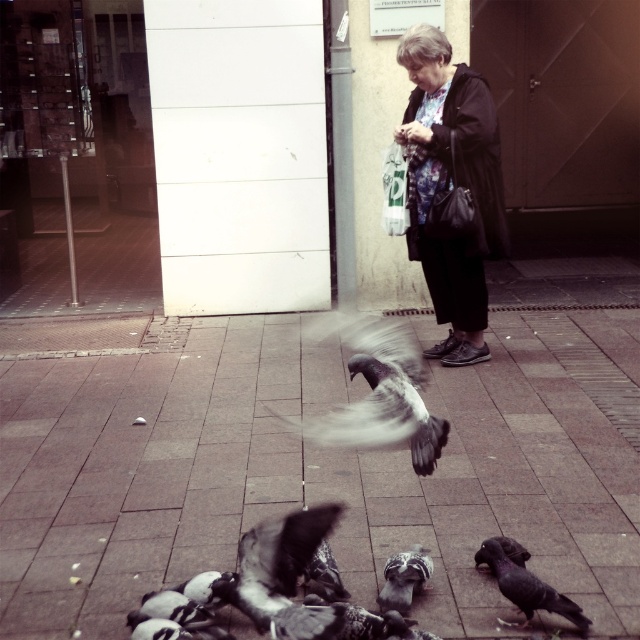
Is black feathered pigeon at lower right in front of gray feathered pigeon at lower center?

Yes, black feathered pigeon at lower right is closer to the viewer.

Does black feathered pigeon at lower right appear on the left side of gray feathered pigeon at lower center?

No, black feathered pigeon at lower right is not to the left of gray feathered pigeon at lower center.

Does point (557, 609) lie in front of point (384, 595)?

Yes, it is.

This screenshot has width=640, height=640. In order to click on black feathered pigeon at lower right in this screenshot , I will do `click(525, 588)`.

Does point (566, 392) come behind point (428, 214)?

No, (566, 392) is closer to viewer.

Find the location of a particular element. brick pavement at center is located at coordinates (147, 465).

Can you confirm if gray feathered bird at center is smaller than gray feathered pigeon at lower center?

Incorrect, gray feathered bird at center is not smaller in size than gray feathered pigeon at lower center.

Can you confirm if gray feathered bird at center is positioned below gray feathered pigeon at lower center?

Actually, gray feathered bird at center is above gray feathered pigeon at lower center.

Identify the location of gray feathered bird at center. The width and height of the screenshot is (640, 640). (381, 396).